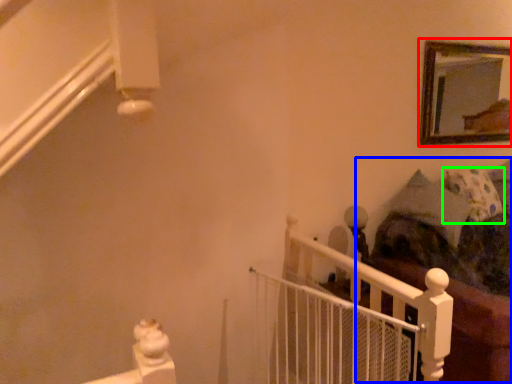
Question: Based on their relative distances, which object is farther from picture frame (highlighted by a red box)? Choose from bed (highlighted by a blue box) and pillow (highlighted by a green box).

Choices:
 (A) bed
 (B) pillow

Answer: (A)